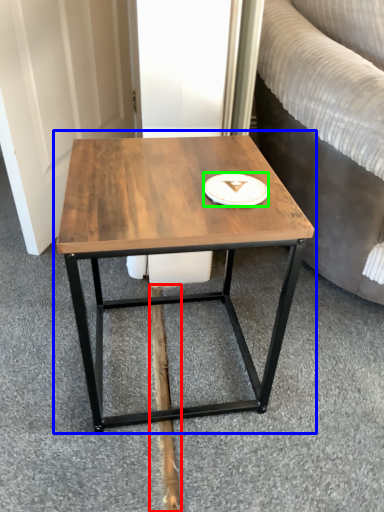
Question: Considering the real-world distances, which object is closest to plank (highlighted by a red box)? coffee table (highlighted by a blue box) or platter (highlighted by a green box).

Choices:
 (A) coffee table
 (B) platter

Answer: (A)